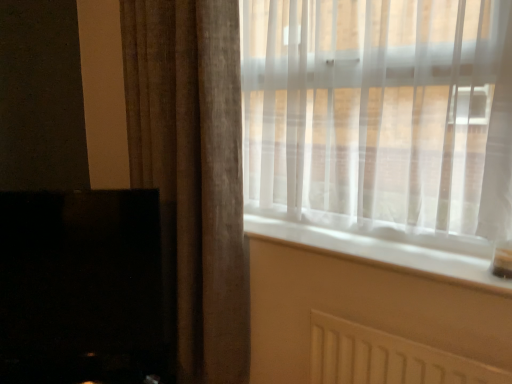
Question: From a real-world perspective, is translucent fabric window at upper right on white smooth window sill at center?

Choices:
 (A) no
 (B) yes

Answer: (B)

Question: Is translucent fabric window at upper right completely or partially outside of white smooth window sill at center?

Choices:
 (A) no
 (B) yes

Answer: (B)

Question: Is translucent fabric window at upper right next to white smooth window sill at center and touching it?

Choices:
 (A) yes
 (B) no

Answer: (B)

Question: From the image's perspective, is translucent fabric window at upper right above white smooth window sill at center?

Choices:
 (A) no
 (B) yes

Answer: (B)

Question: Is translucent fabric window at upper right taller than white smooth window sill at center?

Choices:
 (A) no
 (B) yes

Answer: (B)

Question: Looking at the image, does black glossy fireplace at lower left seem bigger or smaller compared to translucent fabric window at upper right?

Choices:
 (A) small
 (B) big

Answer: (A)

Question: Is point (147, 200) positioned closer to the camera than point (346, 62)?

Choices:
 (A) closer
 (B) farther

Answer: (A)

Question: From the image's perspective, is black glossy fireplace at lower left located above or below translucent fabric window at upper right?

Choices:
 (A) below
 (B) above

Answer: (A)

Question: Looking at their shapes, would you say black glossy fireplace at lower left is wider or thinner than translucent fabric window at upper right?

Choices:
 (A) thin
 (B) wide

Answer: (A)

Question: Is brown textured curtain at left taller or shorter than black glossy fireplace at lower left?

Choices:
 (A) tall
 (B) short

Answer: (A)

Question: From a real-world perspective, is brown textured curtain at left physically located above or below black glossy fireplace at lower left?

Choices:
 (A) below
 (B) above

Answer: (B)

Question: Is point (243, 296) positioned closer to the camera than point (24, 220)?

Choices:
 (A) farther
 (B) closer

Answer: (A)

Question: Is brown textured curtain at left to the left or to the right of black glossy fireplace at lower left in the image?

Choices:
 (A) left
 (B) right

Answer: (B)

Question: Is brown textured curtain at left wider or thinner than translucent fabric window at upper right?

Choices:
 (A) thin
 (B) wide

Answer: (B)

Question: Do you think brown textured curtain at left is within translucent fabric window at upper right, or outside of it?

Choices:
 (A) inside
 (B) outside

Answer: (B)